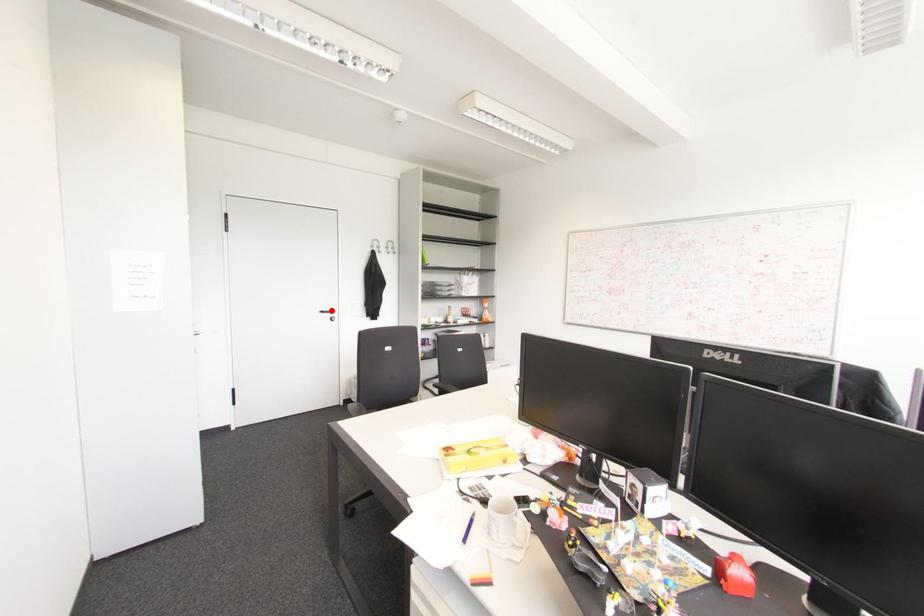
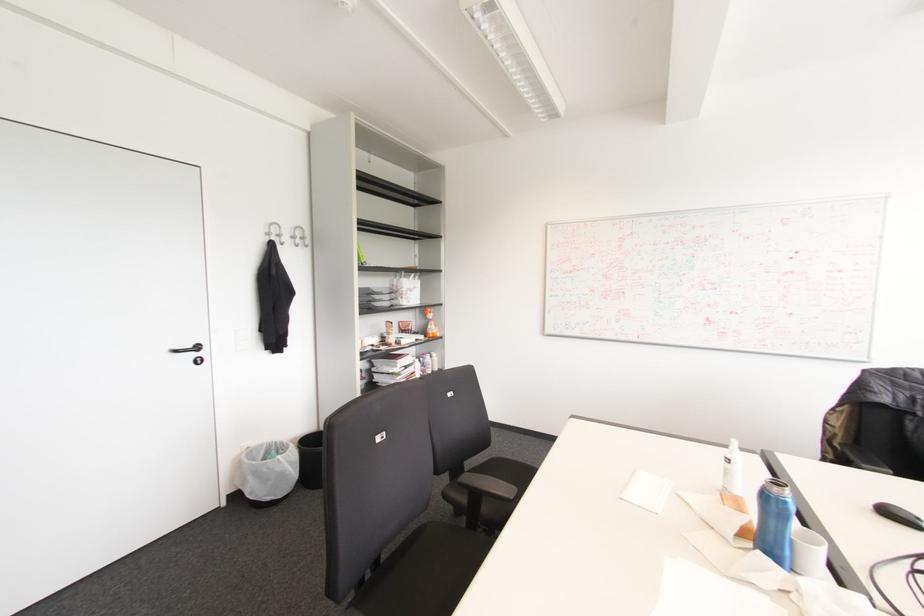
Locate, in the second image, the point that corresponds to the highlighted location in the first image.

(197, 347)